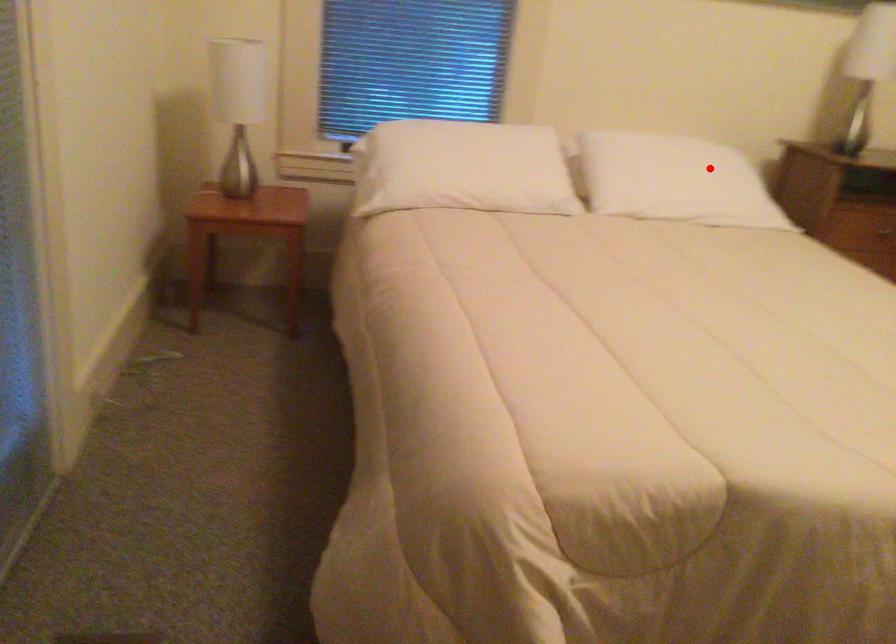
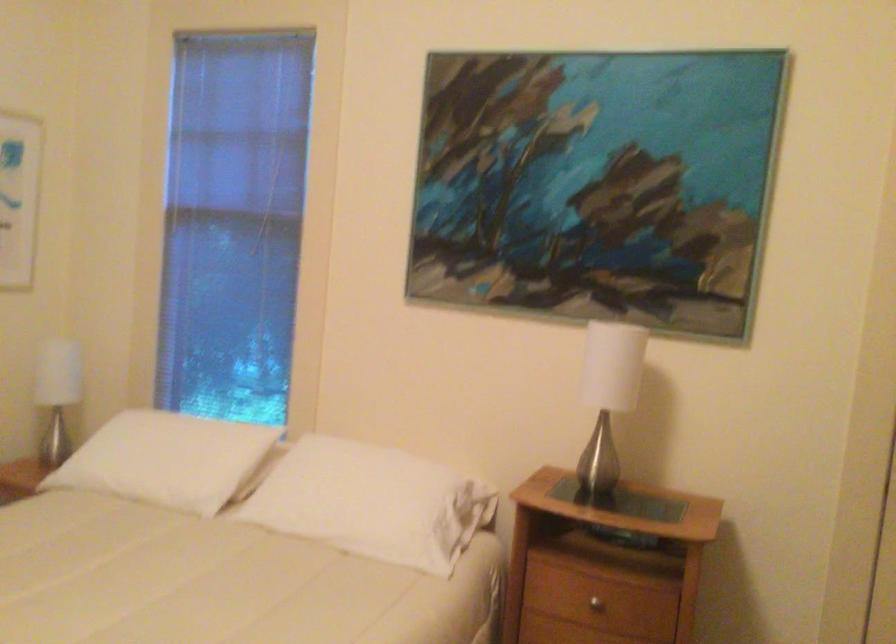
Find the pixel in the second image that matches the highlighted location in the first image.

(373, 502)